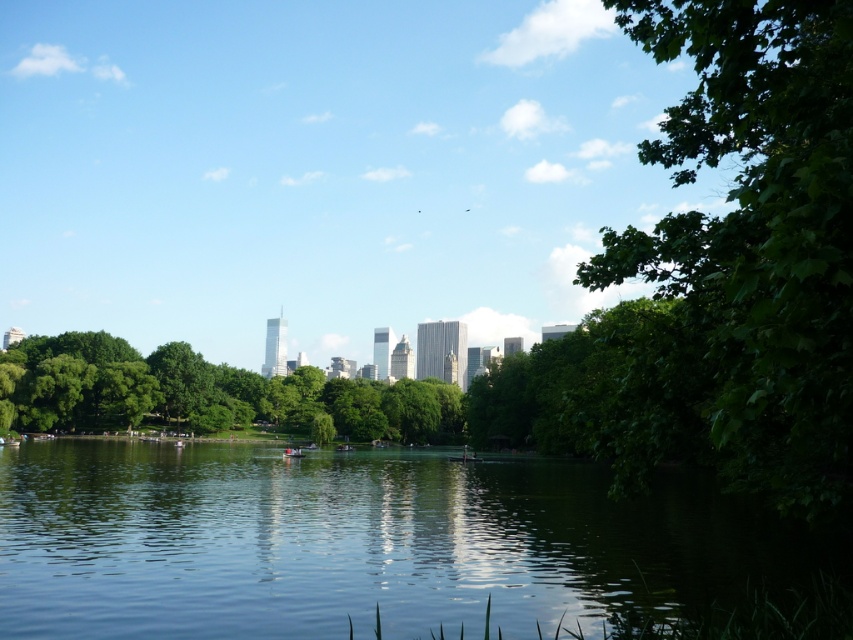
Question: Where is green reflective water at center located in relation to green leafy tree at center in the image?

Choices:
 (A) right
 (B) left

Answer: (A)

Question: Which of the following is the closest to the observer?

Choices:
 (A) green leafy tree at center
 (B) green reflective water at center

Answer: (B)

Question: Which of the following is the closest to the observer?

Choices:
 (A) green leafy tree at center
 (B) green leafy tree at right

Answer: (B)

Question: Can you confirm if green reflective water at center is thinner than green leafy tree at right?

Choices:
 (A) no
 (B) yes

Answer: (A)

Question: Which of the following is the closest to the observer?

Choices:
 (A) (401, 390)
 (B) (531, 557)
 (C) (618, 248)

Answer: (C)

Question: Can you confirm if green reflective water at center is positioned to the right of green leafy tree at right?

Choices:
 (A) no
 (B) yes

Answer: (A)